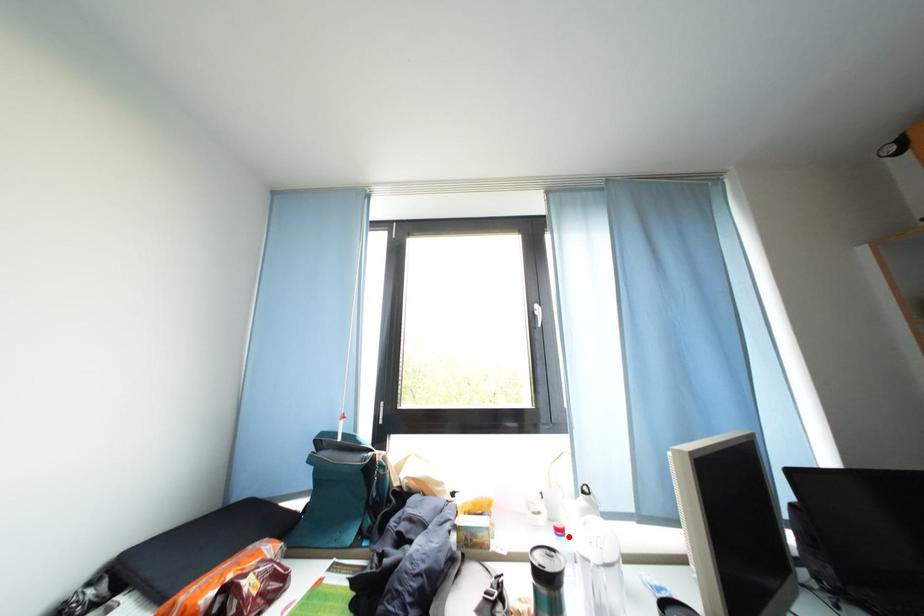
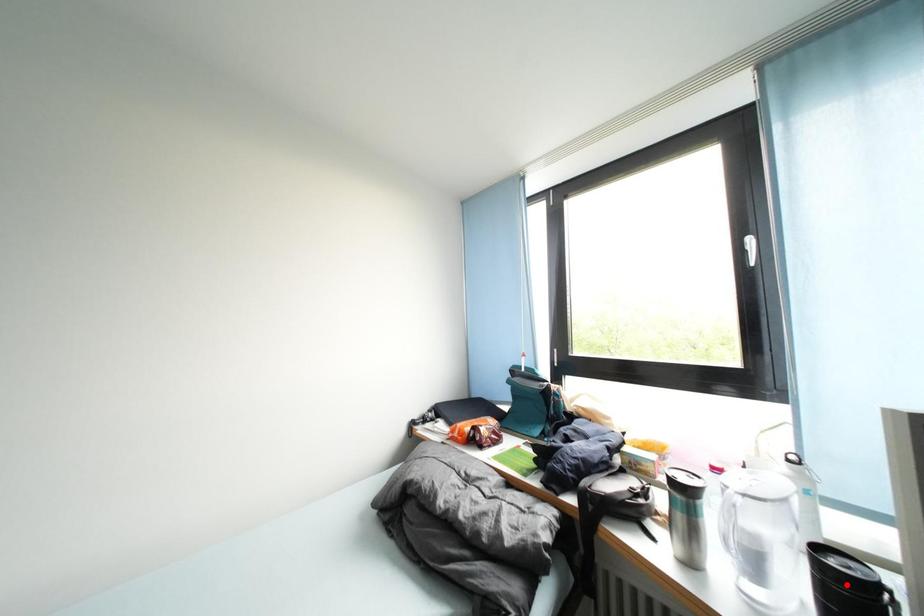
I am providing you with two images of the same scene from different viewpoints. A red point is marked on the first image and another point is marked on the second image. Are the points marked in image1 and image2 representing the same 3D position?

No